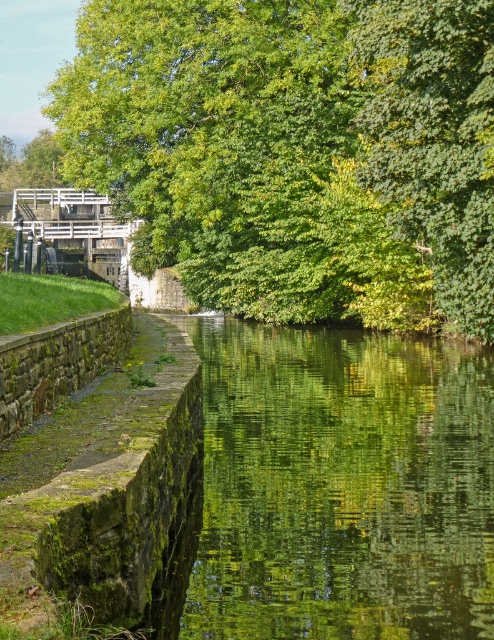
Question: Is the position of green leafy tree at upper center more distant than that of green leafy tree at upper left?

Choices:
 (A) yes
 (B) no

Answer: (B)

Question: Which point appears farthest from the camera in this image?

Choices:
 (A) (8, 154)
 (B) (431, 470)
 (C) (111, 461)
 (D) (327, 320)

Answer: (A)

Question: Considering the relative positions of green leafy tree at upper center and green leafy tree at upper left in the image provided, where is green leafy tree at upper center located with respect to green leafy tree at upper left?

Choices:
 (A) above
 (B) below

Answer: (B)

Question: Among these objects, which one is farthest from the camera?

Choices:
 (A) green leafy tree at upper left
 (B) green leafy tree at upper center

Answer: (A)

Question: Considering the real-world distances, which object is farthest from the green mossy stone at lower left?

Choices:
 (A) green leafy tree at upper left
 (B) green leafy tree at upper center
 (C) green mossy stone at left

Answer: (A)

Question: Is green mossy stone at left positioned in front of green leafy tree at upper left?

Choices:
 (A) yes
 (B) no

Answer: (A)